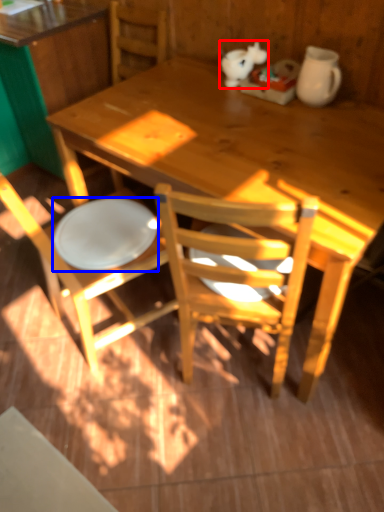
Question: Which point is further to the camera, animal (highlighted by a red box) or plate (highlighted by a blue box)?

Choices:
 (A) animal
 (B) plate

Answer: (A)